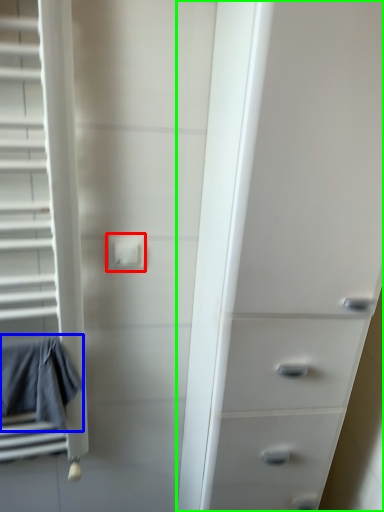
Question: Which object is positioned farthest from electric outlet (highlighted by a red box)? Select from bath towel (highlighted by a blue box) and chest of drawers (highlighted by a green box).

Choices:
 (A) bath towel
 (B) chest of drawers

Answer: (B)